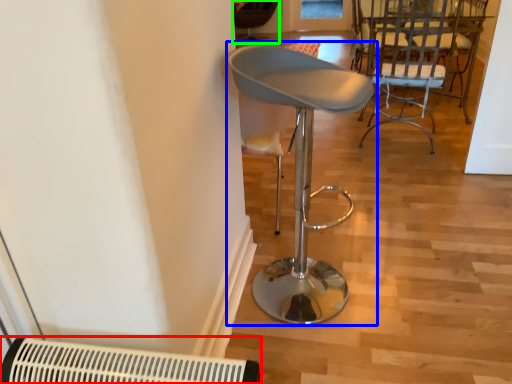
Question: Estimate the real-world distances between objects in this image. Which object is closer to air conditioning (highlighted by a red box), chair (highlighted by a blue box) or chair (highlighted by a green box)?

Choices:
 (A) chair
 (B) chair

Answer: (A)